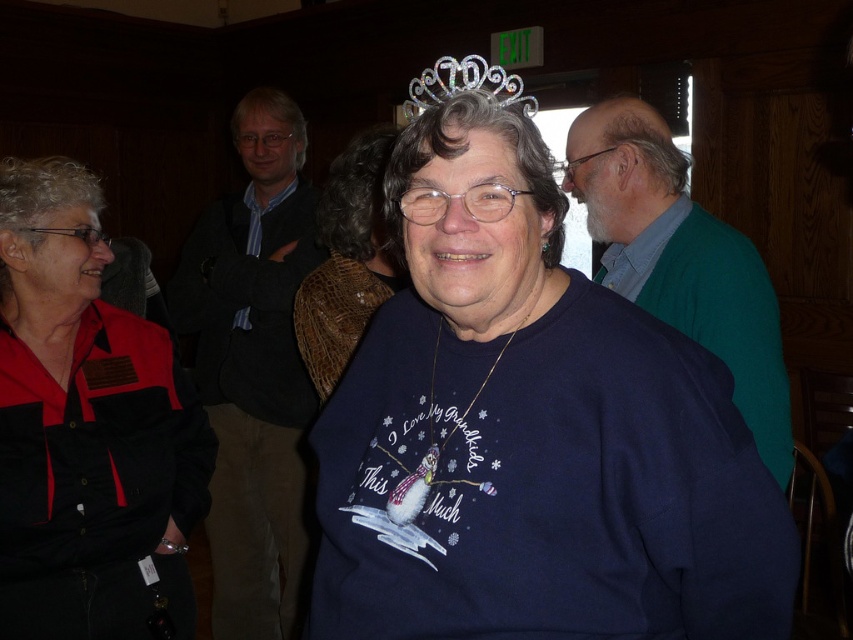
Question: Among these points, which one is farthest from the camera?

Choices:
 (A) (9, 192)
 (B) (321, 371)
 (C) (418, 109)

Answer: (B)

Question: Estimate the real-world distances between objects in this image. Which object is farther from the brown woven shawl at center?

Choices:
 (A) clear plastic tiara at upper center
 (B) black fabric shirt at center

Answer: (B)

Question: Is black fabric shirt at center smaller than clear plastic tiara at upper center?

Choices:
 (A) no
 (B) yes

Answer: (B)

Question: Among these points, which one is nearest to the camera?

Choices:
 (A) (3, 353)
 (B) (415, 102)
 (C) (374, 125)

Answer: (B)

Question: Does brown woven shawl at center come behind clear plastic tiara at upper center?

Choices:
 (A) yes
 (B) no

Answer: (A)

Question: Does black fabric shirt at center appear on the left side of clear plastic tiara at upper center?

Choices:
 (A) no
 (B) yes

Answer: (B)